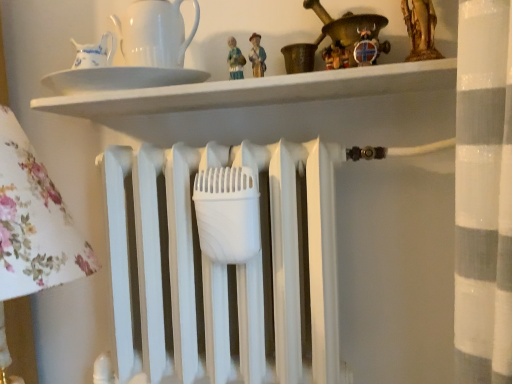
Question: From a real-world perspective, is white glossy plate at upper center physically located above or below wooden viking helmet at upper center?

Choices:
 (A) above
 (B) below

Answer: (B)

Question: Choose the correct answer: Is white glossy plate at upper center inside wooden viking helmet at upper center or outside it?

Choices:
 (A) inside
 (B) outside

Answer: (B)

Question: Estimate the real-world distances between objects in this image. Which object is closer to the wooden viking helmet at upper center?

Choices:
 (A) white glossy pitcher at upper left
 (B) white glossy plate at upper center

Answer: (B)

Question: Which of these objects is positioned closest to the wooden viking helmet at upper center?

Choices:
 (A) white glossy pitcher at upper left
 (B) white glossy plate at upper center

Answer: (B)